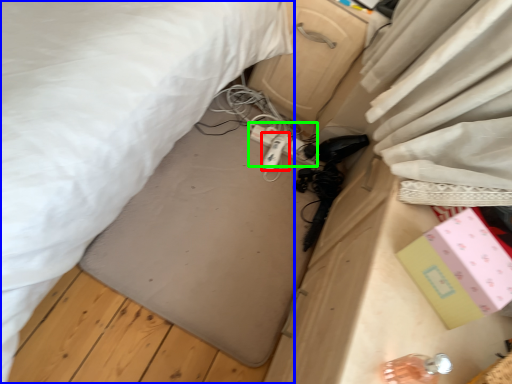
Question: Which is nearer to the equipment (highlighted by a red box)? bed (highlighted by a blue box) or extension cord (highlighted by a green box).

Choices:
 (A) bed
 (B) extension cord

Answer: (B)